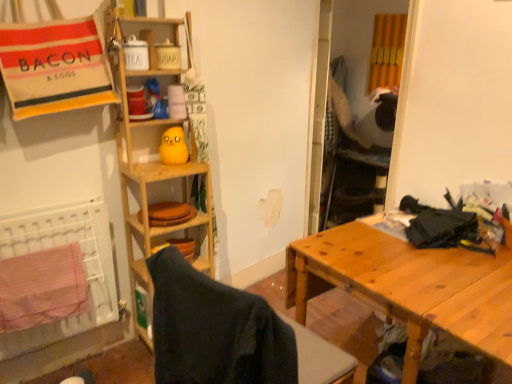
Where is `wooden shelf at center`? wooden shelf at center is located at coordinates (161, 163).

Measure the distance between point [182,125] and camera.

Point [182,125] is 6.56 feet from camera.

The image size is (512, 384). Identify the location of wooden table at right. (x=409, y=286).

Which is in front, point (169, 123) or point (52, 312)?

The point (52, 312) is in front.

Is wooden shelf at center outside of red checkered beach towel at lower left?

Indeed, wooden shelf at center is completely outside red checkered beach towel at lower left.

From a real-world perspective, is wooden shelf at center beneath red checkered beach towel at lower left?

No, from a real-world perspective, wooden shelf at center is not beneath red checkered beach towel at lower left.

Is wooden shelf at center far away from wooden folding chair at center?

No, wooden shelf at center is in close proximity to wooden folding chair at center.

From a real-world perspective, is wooden shelf at center over wooden folding chair at center?

Yes.

In the image, there is a wooden shelf at center. Where is `folding chair below it (from a real-world perspective)`? Image resolution: width=512 pixels, height=384 pixels. folding chair below it (from a real-world perspective) is located at coordinates (231, 334).

Considering the relative sizes of wooden table at right and yellow matte plush toy at upper center in the image provided, is wooden table at right thinner than yellow matte plush toy at upper center?

In fact, wooden table at right might be wider than yellow matte plush toy at upper center.

Is wooden table at right taller or shorter than yellow matte plush toy at upper center?

wooden table at right is taller than yellow matte plush toy at upper center.

Could you tell me if wooden table at right is facing yellow matte plush toy at upper center?

No, wooden table at right is not turned towards yellow matte plush toy at upper center.

From the image's perspective, relative to yellow matte plush toy at upper center, is wooden table at right above or below?

wooden table at right is below yellow matte plush toy at upper center.

How many degrees apart are the facing directions of yellow matte plush toy at upper center and red checkered beach towel at lower left?

They differ by 1.42 degrees in their facing directions.

Does yellow matte plush toy at upper center have a lesser height compared to red checkered beach towel at lower left?

Yes, yellow matte plush toy at upper center is shorter than red checkered beach towel at lower left.

What are the coordinates of `beach towel that appears in front of the yellow matte plush toy at upper center` in the screenshot? It's located at (42, 287).

Can you confirm if wooden folding chair at center is smaller than red checkered beach towel at lower left?

No, wooden folding chair at center is not smaller than red checkered beach towel at lower left.

Considering the relative sizes of wooden folding chair at center and red checkered beach towel at lower left in the image provided, is wooden folding chair at center shorter than red checkered beach towel at lower left?

Incorrect, the height of wooden folding chair at center does not fall short of that of red checkered beach towel at lower left.

Which of these two, wooden folding chair at center or red checkered beach towel at lower left, is wider?

With larger width is wooden folding chair at center.

Measure the distance between wooden folding chair at center and red checkered beach towel at lower left.

A distance of 77.03 centimeters exists between wooden folding chair at center and red checkered beach towel at lower left.

From a real-world perspective, which object stands above the other?

In real-world perspective, wooden shelf at center is above.

Based on the photo, is wooden table at right turned away from wooden shelf at center?

No, wooden table at right's orientation is not away from wooden shelf at center.

From the image's perspective, is wooden table at right beneath wooden shelf at center?

Yes.

Is wooden folding chair at center beside wooden shelf at center?

No, wooden folding chair at center is not with wooden shelf at center.

Which of these two, wooden folding chair at center or wooden shelf at center, is thinner?

With smaller width is wooden shelf at center.

Would you say wooden folding chair at center contains wooden shelf at center?

No, wooden folding chair at center does not contain wooden shelf at center.

In the image, there is a red checkered beach towel at lower left. What are the coordinates of `shelf above it (from the image's perspective)` in the screenshot? It's located at (161, 163).

This screenshot has height=384, width=512. I want to click on shelf that appears behind the wooden folding chair at center, so click(x=161, y=163).

From the image, which object appears to be farther from wooden table at right, red checkered beach towel at lower left or wooden shelf at center?

The object further to wooden table at right is red checkered beach towel at lower left.

Considering their positions, is wooden folding chair at center positioned closer to wooden table at right than red checkered beach towel at lower left?

Among the two, wooden folding chair at center is located nearer to wooden table at right.

Based on their spatial positions, is wooden shelf at center or wooden folding chair at center closer to red checkered beach towel at lower left?

The object closer to red checkered beach towel at lower left is wooden shelf at center.

Estimate the real-world distances between objects in this image. Which object is further from wooden table at right, yellow matte plush toy at upper center or wooden folding chair at center?

yellow matte plush toy at upper center lies further to wooden table at right than the other object.

When comparing their distances from wooden shelf at center, does wooden folding chair at center or yellow matte plush toy at upper center seem closer?

yellow matte plush toy at upper center is positioned closer to the anchor wooden shelf at center.

When comparing their distances from wooden folding chair at center, does yellow matte plush toy at upper center or wooden table at right seem closer?

wooden table at right is closer to wooden folding chair at center.

When comparing their distances from wooden shelf at center, does wooden table at right or red checkered beach towel at lower left seem further?

wooden table at right.

Based on the photo, from the image, which object appears to be nearer to wooden table at right, wooden shelf at center or red checkered beach towel at lower left?

Based on the image, wooden shelf at center appears to be nearer to wooden table at right.

You are a GUI agent. You are given a task and a screenshot of the screen. Output one action in this format:
    pyautogui.click(x=<x>, y=<y>)
    Task: Click on the shelf between yellow matte plush toy at upper center and red checkered beach towel at lower left vertically
    Image resolution: width=512 pixels, height=384 pixels.
    Given the screenshot: What is the action you would take?
    pyautogui.click(x=161, y=163)

Find the location of a particular element. The width and height of the screenshot is (512, 384). folding chair situated between red checkered beach towel at lower left and wooden table at right from left to right is located at coordinates (231, 334).

You are a GUI agent. You are given a task and a screenshot of the screen. Output one action in this format:
    pyautogui.click(x=<x>, y=<y>)
    Task: Click on the folding chair between wooden shelf at center and wooden table at right
    
    Given the screenshot: What is the action you would take?
    pyautogui.click(x=231, y=334)

This screenshot has width=512, height=384. Identify the location of folding chair between yellow matte plush toy at upper center and wooden table at right. (231, 334).